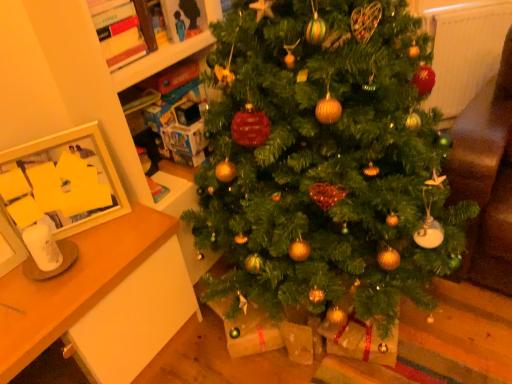
Question: Does point (261, 147) appear closer or farther from the camera than point (168, 238)?

Choices:
 (A) farther
 (B) closer

Answer: (B)

Question: From a real-world perspective, is green matte christmas tree at center positioned above or below wooden desk at left?

Choices:
 (A) below
 (B) above

Answer: (B)

Question: Which object is positioned farthest from the white textured radiator at upper right?

Choices:
 (A) white glossy picture frame at left
 (B) cardboard boxes at upper left
 (C) wooden desk at left
 (D) green matte christmas tree at center

Answer: (C)

Question: Based on their relative distances, which object is farther from the cardboard boxes at upper left?

Choices:
 (A) white textured radiator at upper right
 (B) wooden desk at left
 (C) white glossy picture frame at left
 (D) green matte christmas tree at center

Answer: (A)